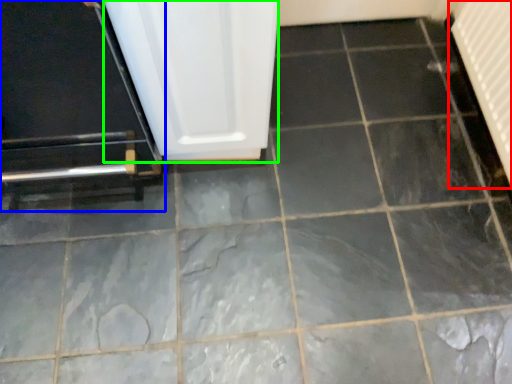
Question: Based on their relative distances, which object is farther from radiator (highlighted by a red box)? Choose from door (highlighted by a blue box) and screen door (highlighted by a green box).

Choices:
 (A) door
 (B) screen door

Answer: (A)